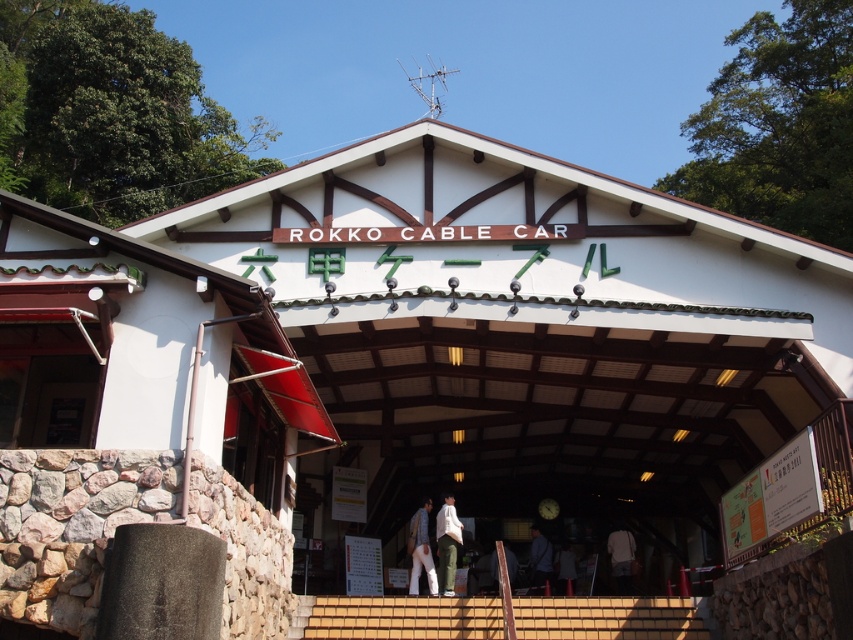
How much distance is there between brown tile stairs at center and light blue jeans at center?

brown tile stairs at center is 6.54 meters away from light blue jeans at center.

Between brown tile stairs at center and light blue jeans at center, which one is positioned higher?

A: brown tile stairs at center is higher up.

Find the location of `brown tile stairs at center`. brown tile stairs at center is located at coordinates (404, 618).

The image size is (853, 640). In order to click on brown tile stairs at center in this screenshot , I will do `click(404, 618)`.

This screenshot has height=640, width=853. I want to click on white fabric at center, so coord(621,557).

Which of these two, brown tile stairs at center or white fabric at center, stands taller?

white fabric at center is taller.

Can you confirm if brown tile stairs at center is positioned above white fabric at center?

Yes.

Who is more forward, (381, 637) or (625, 573)?

Point (381, 637) is more forward.

This screenshot has height=640, width=853. What are the coordinates of `brown tile stairs at center` in the screenshot? It's located at (404, 618).